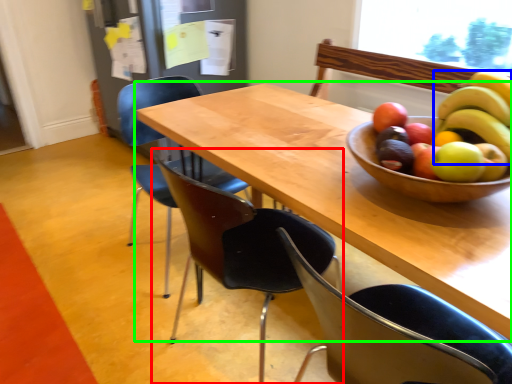
Question: Which object is the closest to the chair (highlighted by a red box)? Choose among these: banana (highlighted by a blue box) or table (highlighted by a green box).

Choices:
 (A) banana
 (B) table

Answer: (B)